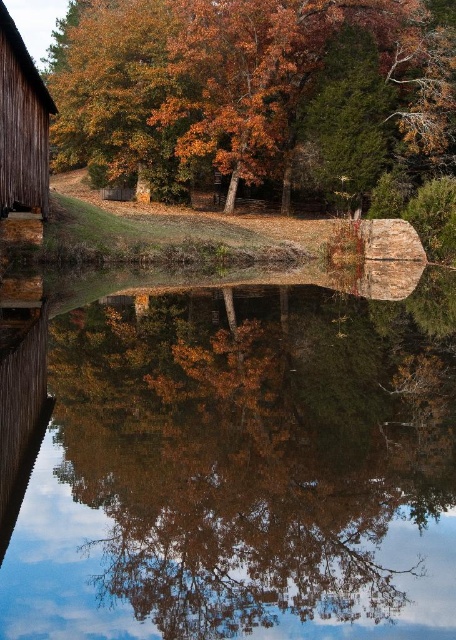
Question: Considering the relative positions of smooth reflective water at center and orange autumn leaves at upper center in the image provided, where is smooth reflective water at center located with respect to orange autumn leaves at upper center?

Choices:
 (A) above
 (B) below

Answer: (B)

Question: Which point is closer to the camera taking this photo?

Choices:
 (A) (5, 36)
 (B) (109, 349)

Answer: (A)

Question: Considering the real-world distances, which object is farthest from the wooden barn at left?

Choices:
 (A) orange autumn leaves at upper center
 (B) smooth reflective water at center

Answer: (A)

Question: Is orange autumn leaves at upper center closer to the viewer compared to wooden barn at left?

Choices:
 (A) yes
 (B) no

Answer: (B)

Question: Which point appears farthest from the camera in this image?

Choices:
 (A) (103, 77)
 (B) (41, 196)

Answer: (A)

Question: Is smooth reflective water at center in front of wooden barn at left?

Choices:
 (A) no
 (B) yes

Answer: (B)